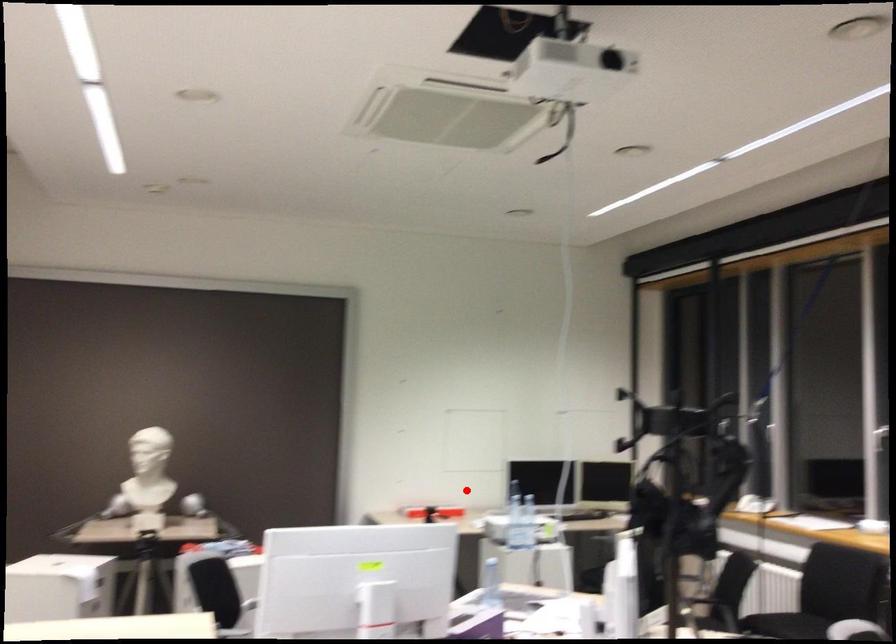
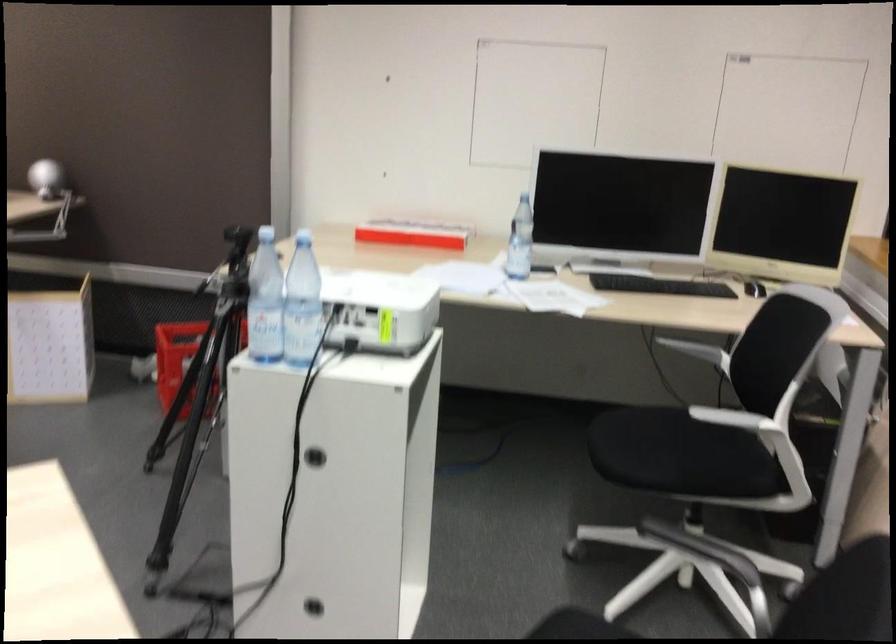
Where in the second image is the point corresponding to the highlighted location from the first image?

(412, 234)